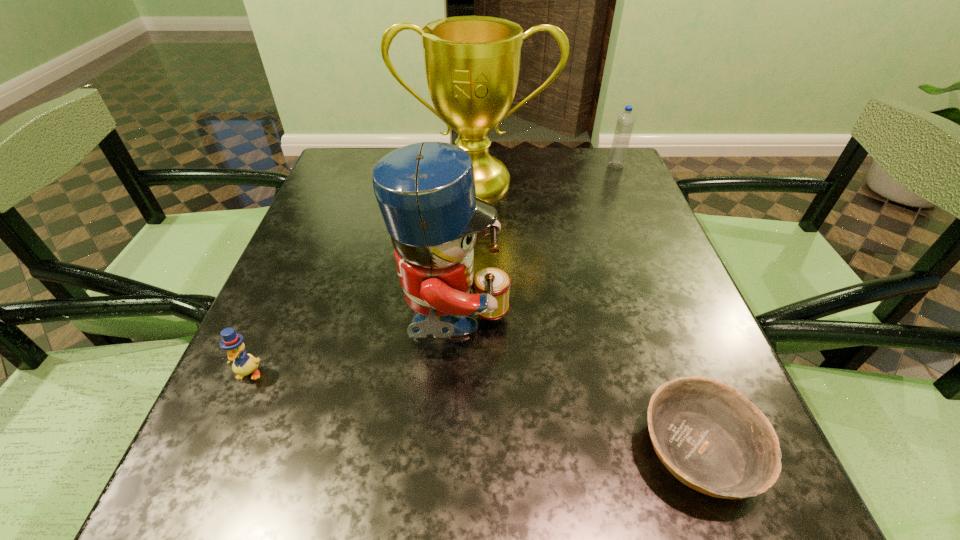
The height and width of the screenshot is (540, 960). Find the location of `award`. award is located at coordinates (472, 63).

This screenshot has height=540, width=960. I want to click on nutcracker, so click(426, 193).

Where is `the third tallest object`? the third tallest object is located at coordinates (625, 122).

I want to click on duckling, so click(x=243, y=364).

The width and height of the screenshot is (960, 540). I want to click on the fourth tallest object, so click(x=243, y=364).

You are a GUI agent. You are given a task and a screenshot of the screen. Output one action in this format:
    pyautogui.click(x=<x>, y=<y>)
    Task: Click on the nearest object
    
    Given the screenshot: What is the action you would take?
    pyautogui.click(x=710, y=437)

Where is `bowl`? bowl is located at coordinates (710, 437).

This screenshot has width=960, height=540. I want to click on free space located on the shiny surface of the award, so click(x=474, y=327).

The image size is (960, 540). I want to click on vacant region located 0.320m on the front-facing side of the nutcracker, so click(689, 326).

In order to click on free spot located 0.060m on the back of the third shortest object in this screenshot , I will do `click(610, 151)`.